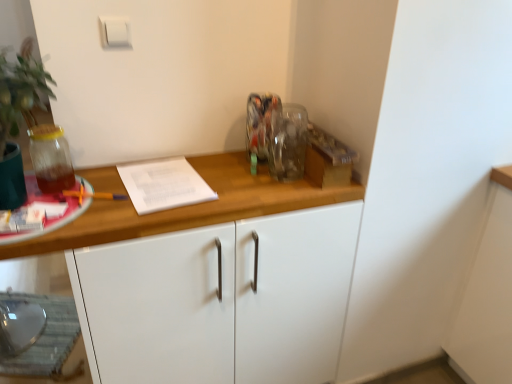
Question: Is white matte cabinet at center facing towards white plastic light switch at upper center?

Choices:
 (A) yes
 (B) no

Answer: (B)

Question: Would you say white matte cabinet at center is outside white plastic light switch at upper center?

Choices:
 (A) yes
 (B) no

Answer: (A)

Question: Is white matte cabinet at center at the right side of white plastic light switch at upper center?

Choices:
 (A) no
 (B) yes

Answer: (B)

Question: Is white matte cabinet at center taller than white plastic light switch at upper center?

Choices:
 (A) no
 (B) yes

Answer: (B)

Question: Is white matte cabinet at center bigger than white plastic light switch at upper center?

Choices:
 (A) yes
 (B) no

Answer: (A)

Question: Considering the relative positions of white matte cabinet at center and white plastic light switch at upper center in the image provided, is white matte cabinet at center to the left of white plastic light switch at upper center from the viewer's perspective?

Choices:
 (A) yes
 (B) no

Answer: (B)

Question: Considering the relative sizes of translucent glass jar at left and white matte cabinet at center in the image provided, is translucent glass jar at left shorter than white matte cabinet at center?

Choices:
 (A) yes
 (B) no

Answer: (A)

Question: Considering the relative positions of translucent glass jar at left and white matte cabinet at center in the image provided, is translucent glass jar at left to the right of white matte cabinet at center from the viewer's perspective?

Choices:
 (A) yes
 (B) no

Answer: (B)

Question: Is translucent glass jar at left facing away from white matte cabinet at center?

Choices:
 (A) no
 (B) yes

Answer: (A)

Question: Is there a large distance between translucent glass jar at left and white matte cabinet at center?

Choices:
 (A) no
 (B) yes

Answer: (A)

Question: Considering the relative sizes of translucent glass jar at left and white matte cabinet at center in the image provided, is translucent glass jar at left bigger than white matte cabinet at center?

Choices:
 (A) yes
 (B) no

Answer: (B)

Question: Does translucent glass jar at left have a smaller size compared to white matte cabinet at center?

Choices:
 (A) yes
 (B) no

Answer: (A)

Question: Does white matte cabinet at center have a larger size compared to translucent glass jar at left?

Choices:
 (A) yes
 (B) no

Answer: (A)